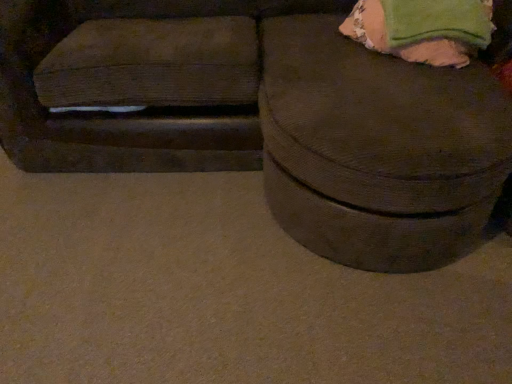
Identify the location of brown corduroy ottoman at center. (261, 116).

What do you see at coordinates (261, 116) in the screenshot? I see `brown corduroy ottoman at center` at bounding box center [261, 116].

What is the approximate height of brown corduroy ottoman at center?

brown corduroy ottoman at center is 34.87 inches tall.

Measure the distance between point (278, 109) and camera.

Point (278, 109) and camera are 4.39 feet apart from each other.

Where is `green fabric bean bag at upper right`? This screenshot has height=384, width=512. green fabric bean bag at upper right is located at coordinates (422, 29).

What do you see at coordinates (422, 29) in the screenshot? I see `green fabric bean bag at upper right` at bounding box center [422, 29].

What is the approximate width of green fabric bean bag at upper right?

green fabric bean bag at upper right is 24.44 inches wide.

Where is `brown corduroy ottoman at center`? Image resolution: width=512 pixels, height=384 pixels. brown corduroy ottoman at center is located at coordinates (261, 116).

Does green fabric bean bag at upper right appear on the right side of brown corduroy ottoman at center?

Correct, you'll find green fabric bean bag at upper right to the right of brown corduroy ottoman at center.

Which object is closer to the camera, green fabric bean bag at upper right or brown corduroy ottoman at center?

brown corduroy ottoman at center is more forward.

Is point (371, 27) in front of point (507, 157)?

No, (371, 27) is further to viewer.

From the image's perspective, which one is positioned lower, green fabric bean bag at upper right or brown corduroy ottoman at center?

brown corduroy ottoman at center.

From a real-world perspective, is green fabric bean bag at upper right over brown corduroy ottoman at center?

Yes, from a real-world perspective, green fabric bean bag at upper right is on top of brown corduroy ottoman at center.

Consider the image. Is green fabric bean bag at upper right wider than brown corduroy ottoman at center?

In fact, green fabric bean bag at upper right might be narrower than brown corduroy ottoman at center.

Considering the sizes of objects green fabric bean bag at upper right and brown corduroy ottoman at center in the image provided, who is shorter, green fabric bean bag at upper right or brown corduroy ottoman at center?

Standing shorter between the two is green fabric bean bag at upper right.

Does green fabric bean bag at upper right have a larger size compared to brown corduroy ottoman at center?

Actually, green fabric bean bag at upper right might be smaller than brown corduroy ottoman at center.

From the picture: Is green fabric bean bag at upper right inside or outside of brown corduroy ottoman at center?

green fabric bean bag at upper right is spatially positioned inside brown corduroy ottoman at center.

Is green fabric bean bag at upper right in contact with brown corduroy ottoman at center?

green fabric bean bag at upper right and brown corduroy ottoman at center are clearly separated.

Does green fabric bean bag at upper right turn towards brown corduroy ottoman at center?

Yes, green fabric bean bag at upper right faces towards brown corduroy ottoman at center.

How much distance is there between green fabric bean bag at upper right and brown corduroy ottoman at center?

They are 16.27 inches apart.

What are the coordinates of `bean bag chair that is above the brown corduroy ottoman at center (from the image's perspective)` in the screenshot? It's located at (422, 29).

Can you confirm if brown corduroy ottoman at center is positioned to the right of green fabric bean bag at upper right?

Incorrect, brown corduroy ottoman at center is not on the right side of green fabric bean bag at upper right.

Which object is further away from the camera, brown corduroy ottoman at center or green fabric bean bag at upper right?

green fabric bean bag at upper right is further from the camera.

Which is in front, point (6, 21) or point (450, 58)?

Point (450, 58)

Consider the image. From the image's perspective, is brown corduroy ottoman at center located above or below green fabric bean bag at upper right?

Clearly, from the image's perspective, brown corduroy ottoman at center is below green fabric bean bag at upper right.

From a real-world perspective, is brown corduroy ottoman at center over green fabric bean bag at upper right?

No, from a real-world perspective, brown corduroy ottoman at center is not on top of green fabric bean bag at upper right.

Considering the relative sizes of brown corduroy ottoman at center and green fabric bean bag at upper right in the image provided, is brown corduroy ottoman at center thinner than green fabric bean bag at upper right?

Incorrect, the width of brown corduroy ottoman at center is not less than that of green fabric bean bag at upper right.

Is brown corduroy ottoman at center taller than green fabric bean bag at upper right?

Yes, brown corduroy ottoman at center is taller than green fabric bean bag at upper right.

Does brown corduroy ottoman at center have a smaller size compared to green fabric bean bag at upper right?

Actually, brown corduroy ottoman at center might be larger than green fabric bean bag at upper right.

Choose the correct answer: Is brown corduroy ottoman at center inside green fabric bean bag at upper right or outside it?

brown corduroy ottoman at center is outside green fabric bean bag at upper right.

In the scene shown: Is the surface of brown corduroy ottoman at center in direct contact with green fabric bean bag at upper right?

No, brown corduroy ottoman at center is not making contact with green fabric bean bag at upper right.

Is brown corduroy ottoman at center facing towards green fabric bean bag at upper right?

Yes, brown corduroy ottoman at center is turned towards green fabric bean bag at upper right.

Find the location of a particular element. The height and width of the screenshot is (384, 512). furniture below the green fabric bean bag at upper right (from a real-world perspective) is located at coordinates (261, 116).

At what (x,y) coordinates should I click in order to perform the action: click on bean bag chair lying above the brown corduroy ottoman at center (from the image's perspective). Please return your answer as a coordinate pair (x, y). The height and width of the screenshot is (384, 512). Looking at the image, I should click on (422, 29).

Locate an element on the screen. The image size is (512, 384). furniture below the green fabric bean bag at upper right (from the image's perspective) is located at coordinates (261, 116).